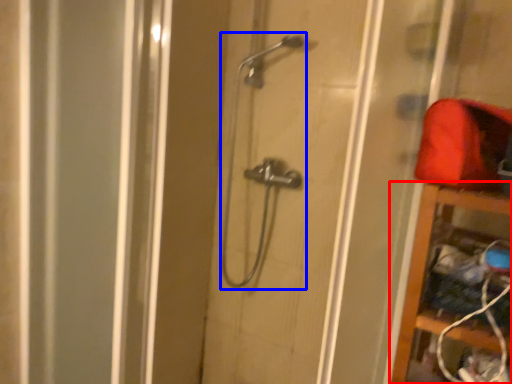
Question: Which point is closer to the camera, cabinet (highlighted by a red box) or shower (highlighted by a blue box)?

Choices:
 (A) cabinet
 (B) shower

Answer: (A)